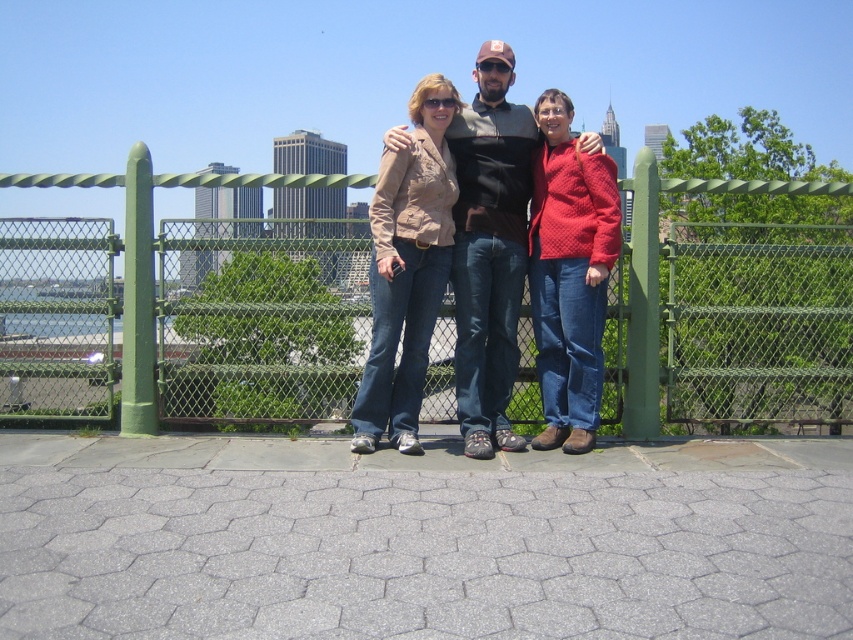
Question: Can you confirm if dark gray textured shirt at center is smaller than green chain-link fence at center?

Choices:
 (A) yes
 (B) no

Answer: (B)

Question: Estimate the real-world distances between objects in this image. Which object is closer to the matte black sunglasses at center?

Choices:
 (A) knitted red sweater at center
 (B) matte brown blazer at center

Answer: (B)

Question: Is the position of dark gray textured shirt at center less distant than that of green chain-link fence at center?

Choices:
 (A) no
 (B) yes

Answer: (B)

Question: Is green chain-link fence at center further to the viewer compared to matte brown blazer at center?

Choices:
 (A) yes
 (B) no

Answer: (A)

Question: Which point is farther from the camera taking this photo?

Choices:
 (A) (456, 380)
 (B) (556, 108)

Answer: (A)

Question: Among these points, which one is nearest to the camera?

Choices:
 (A) (386, 200)
 (B) (753, 186)

Answer: (A)